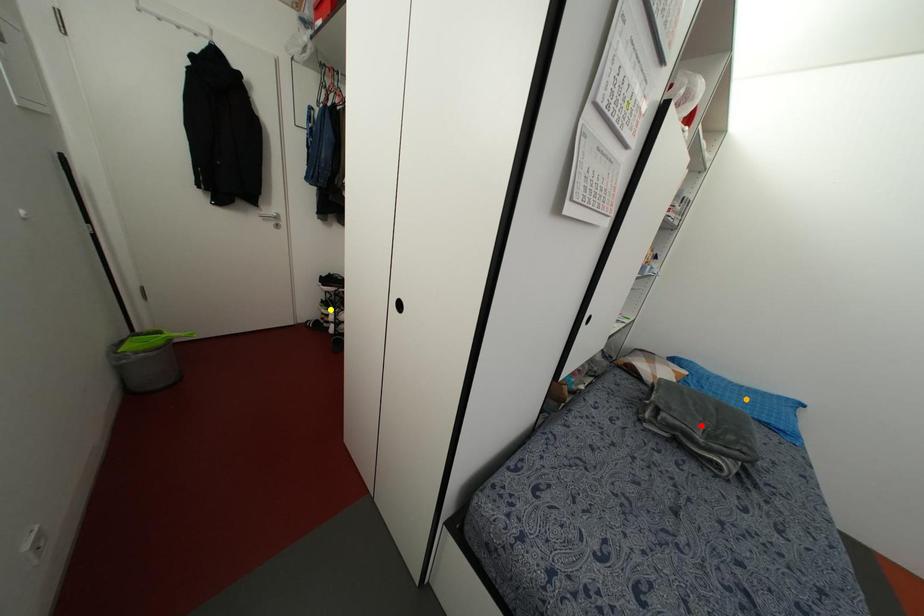
Order these from nearest to farthest:
A) orange point
B) red point
C) yellow point

red point, orange point, yellow point